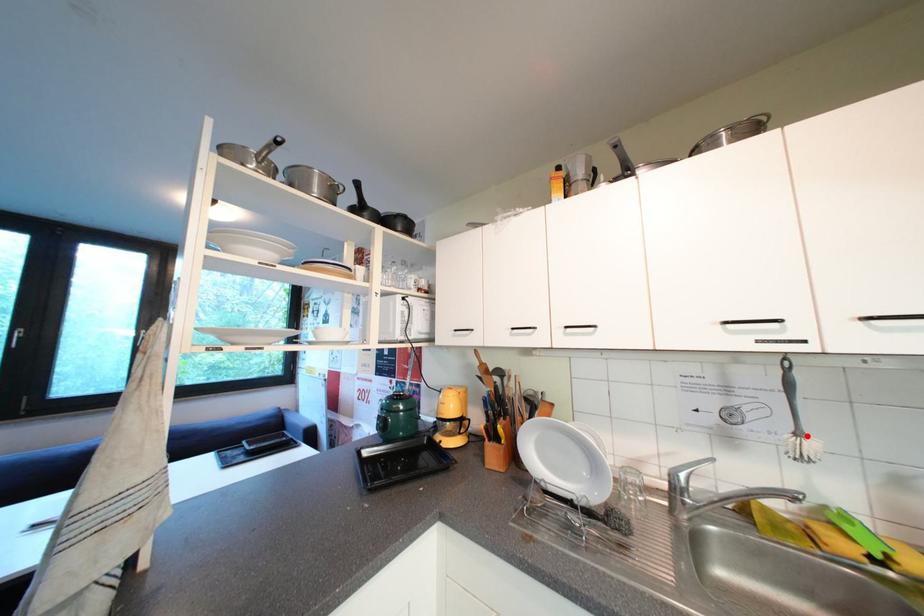
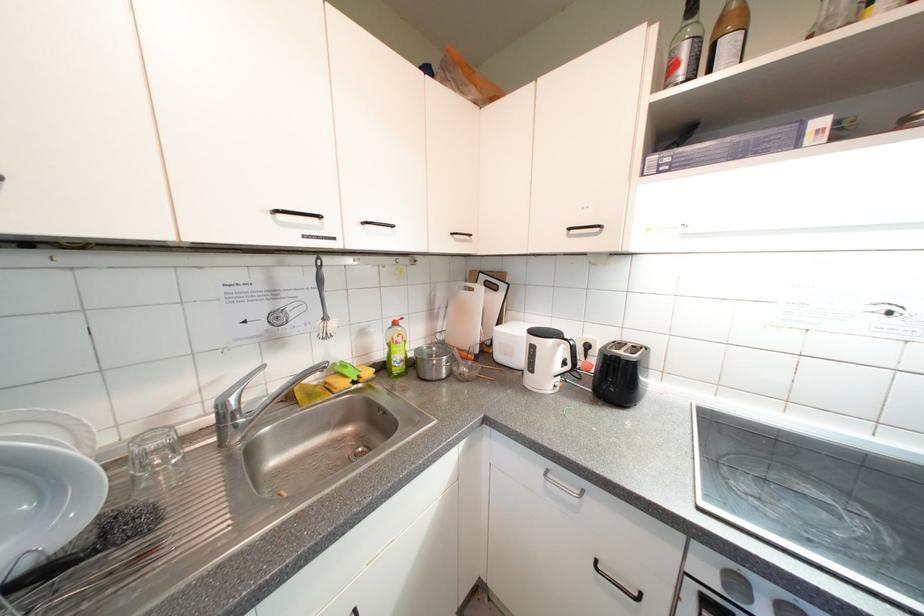
Locate, in the second image, the point that corresponds to the highlighted location in the first image.

(333, 321)